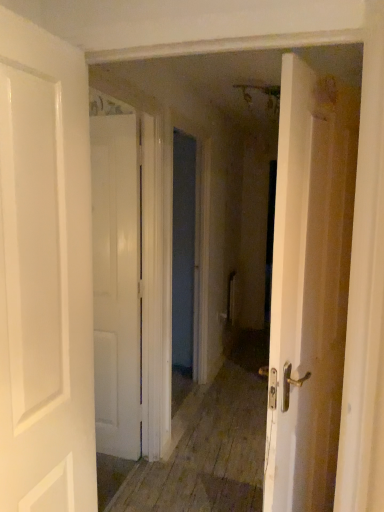
Question: Is white glossy door at left, arranged as the 2th door when viewed from the back, taller or shorter than white matte door at center, the first door positioned from the back?

Choices:
 (A) tall
 (B) short

Answer: (B)

Question: From the image's perspective, relative to white matte door at center, which ranks as the 2th door in front-to-back order, is white glossy door at left, which appears as the first door when viewed from the front, above or below?

Choices:
 (A) above
 (B) below

Answer: (A)

Question: Is white glossy door at left, arranged as the 2th door when viewed from the back, situated inside white matte door at center, the first door positioned from the back, or outside?

Choices:
 (A) inside
 (B) outside

Answer: (B)

Question: Considering the positions of white matte door at center, which ranks as the 2th door in front-to-back order, and white glossy door at left, which appears as the first door when viewed from the front, in the image, is white matte door at center, which ranks as the 2th door in front-to-back order, wider or thinner than white glossy door at left, which appears as the first door when viewed from the front,?

Choices:
 (A) thin
 (B) wide

Answer: (A)

Question: Considering the positions of white matte door at center, the first door positioned from the back, and white glossy door at left, arranged as the 2th door when viewed from the back, in the image, is white matte door at center, the first door positioned from the back, bigger or smaller than white glossy door at left, arranged as the 2th door when viewed from the back,?

Choices:
 (A) small
 (B) big

Answer: (A)

Question: Relative to white glossy door at left, which appears as the first door when viewed from the front, is white matte door at center, the first door positioned from the back, in front or behind?

Choices:
 (A) front
 (B) behind

Answer: (B)

Question: Would you say white matte door at center, the first door positioned from the back, is to the left or to the right of white glossy door at left, arranged as the 2th door when viewed from the back, in the picture?

Choices:
 (A) left
 (B) right

Answer: (B)